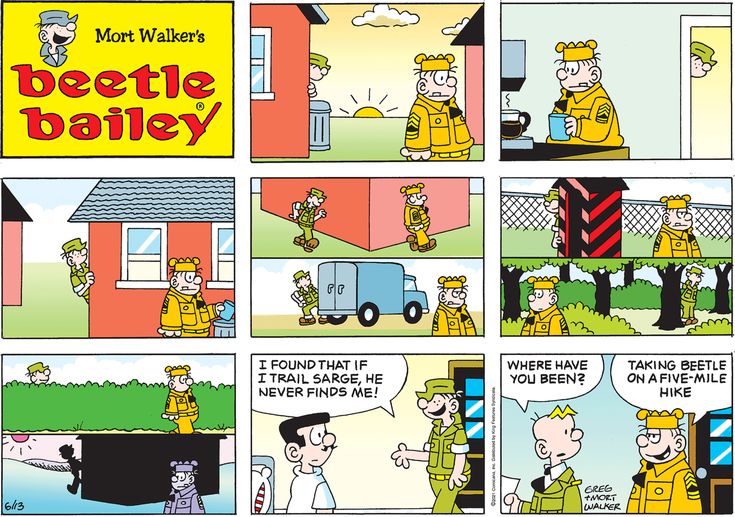
Identify the location of frames of comic strip. (342, 82), (663, 103), (645, 226), (451, 239), (196, 234), (129, 402), (372, 445), (600, 419).